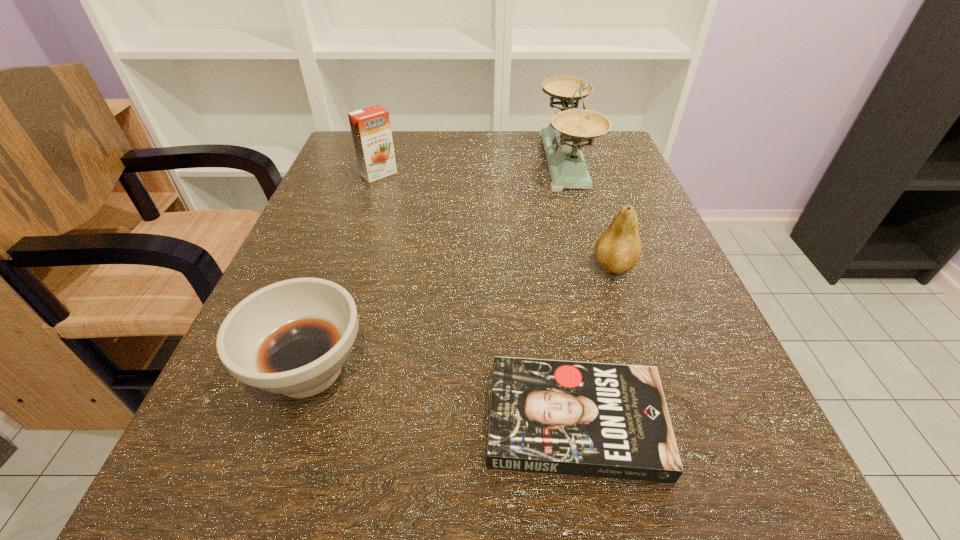
Find the location of `vacant space that is in between the orange juice and the second shortest object`. vacant space that is in between the orange juice and the second shortest object is located at coordinates (344, 272).

Locate an element on the screen. The height and width of the screenshot is (540, 960). vacant area between the scale and the shortest object is located at coordinates (570, 291).

At what (x,y) coordinates should I click in order to perform the action: click on empty space between the pear and the shortest object. Please return your answer as a coordinate pair (x, y). Looking at the image, I should click on (594, 343).

At what (x,y) coordinates should I click in order to perform the action: click on free spot between the book and the third farthest object. Please return your answer as a coordinate pair (x, y). The image size is (960, 540). Looking at the image, I should click on (594, 343).

Find the location of a particular element. The image size is (960, 540). vacant region between the book and the scale is located at coordinates (570, 291).

The height and width of the screenshot is (540, 960). Identify the location of blank region between the pear and the scale. (589, 213).

Image resolution: width=960 pixels, height=540 pixels. Find the location of `free space between the scale and the pear`. free space between the scale and the pear is located at coordinates (589, 213).

Identify the location of unoccupied area between the second shortest object and the tallest object. (437, 265).

At what (x,y) coordinates should I click in order to perform the action: click on object that is the second closest to the shortest object. Please return your answer as a coordinate pair (x, y). This screenshot has height=540, width=960. Looking at the image, I should click on (618, 248).

The width and height of the screenshot is (960, 540). I want to click on the fourth closest object to the book, so click(x=371, y=130).